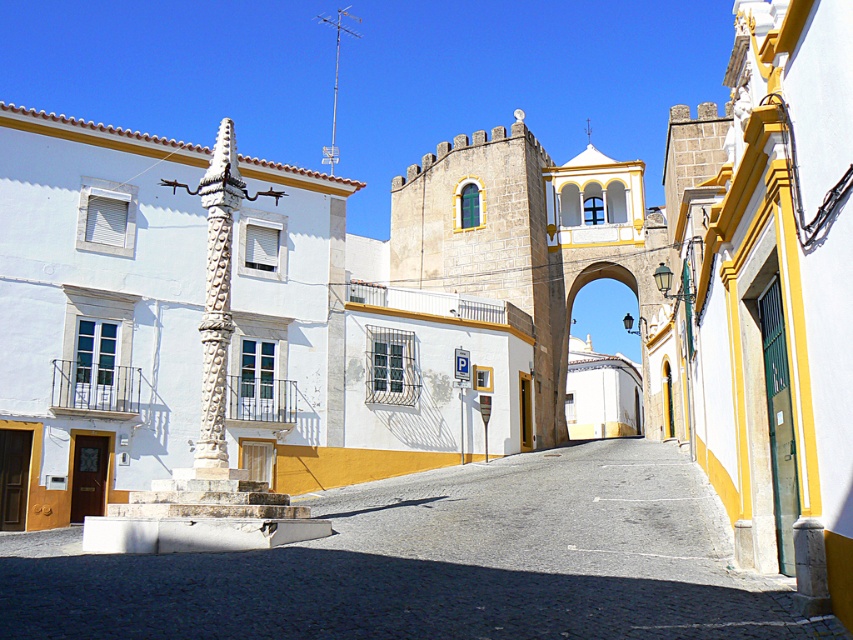
Does smooth stone alley at center have a greater width compared to white stone column at center?

Yes, smooth stone alley at center is wider than white stone column at center.

Which is above, smooth stone alley at center or white stone column at center?

white stone column at center

Find the location of a particular element. The width and height of the screenshot is (853, 640). smooth stone alley at center is located at coordinates (438, 563).

In order to click on white stone column at center in this screenshot , I will do `click(216, 300)`.

Is white stone column at center to the left of white stone archway at center from the viewer's perspective?

Correct, you'll find white stone column at center to the left of white stone archway at center.

Who is more distant from viewer, (229,214) or (624,272)?

The point (624,272) is more distant.

Find the location of a particular element. white stone column at center is located at coordinates (216, 300).

Does smooth stone alley at center have a greater height compared to white stone archway at center?

Incorrect, smooth stone alley at center's height is not larger of white stone archway at center's.

Between smooth stone alley at center and white stone archway at center, which one is positioned lower?

Positioned lower is smooth stone alley at center.

Which is in front, point (494, 506) or point (607, 346)?

Point (494, 506)

Where is `smooth stone alley at center`? The width and height of the screenshot is (853, 640). smooth stone alley at center is located at coordinates (438, 563).